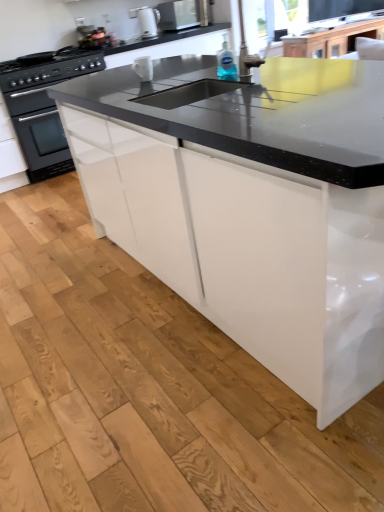
Question: Is black matte oven at left oriented away from white glossy electric kettle at upper center, which is counted as the 2th appliance, starting from the right?

Choices:
 (A) yes
 (B) no

Answer: (B)

Question: Can you see black matte oven at left touching white glossy electric kettle at upper center, arranged as the 1th appliance when viewed from the left?

Choices:
 (A) yes
 (B) no

Answer: (B)

Question: Considering the relative sizes of black matte oven at left and white glossy electric kettle at upper center, which is counted as the 2th appliance, starting from the right, in the image provided, is black matte oven at left taller than white glossy electric kettle at upper center, which is counted as the 2th appliance, starting from the right,?

Choices:
 (A) yes
 (B) no

Answer: (A)

Question: From the image's perspective, is black matte oven at left under white glossy electric kettle at upper center, which appears as the 1th appliance when viewed from the top?

Choices:
 (A) no
 (B) yes

Answer: (B)

Question: Does black matte oven at left have a greater width compared to white glossy electric kettle at upper center, which is counted as the 2th appliance, starting from the right?

Choices:
 (A) no
 (B) yes

Answer: (B)

Question: From their relative heights in the image, would you say transparent plastic bottle at upper center is taller or shorter than black matte oven at left?

Choices:
 (A) short
 (B) tall

Answer: (A)

Question: From a real-world perspective, is transparent plastic bottle at upper center physically located above or below black matte oven at left?

Choices:
 (A) above
 (B) below

Answer: (A)

Question: Considering the relative positions of transparent plastic bottle at upper center and black matte oven at left in the image provided, is transparent plastic bottle at upper center to the left or to the right of black matte oven at left?

Choices:
 (A) right
 (B) left

Answer: (A)

Question: In terms of size, does transparent plastic bottle at upper center appear bigger or smaller than black matte oven at left?

Choices:
 (A) small
 (B) big

Answer: (A)

Question: From a real-world perspective, is white glossy mug at upper center, the second appliance when ordered from left to right, above or below black matte oven at left?

Choices:
 (A) above
 (B) below

Answer: (A)

Question: Does point (142, 66) appear closer or farther from the camera than point (66, 59)?

Choices:
 (A) farther
 (B) closer

Answer: (B)

Question: In terms of width, does white glossy mug at upper center, the second appliance when ordered from left to right, look wider or thinner when compared to black matte oven at left?

Choices:
 (A) thin
 (B) wide

Answer: (A)

Question: From the image's perspective, relative to black matte oven at left, is white glossy mug at upper center, the 2th appliance when ordered from back to front, above or below?

Choices:
 (A) below
 (B) above

Answer: (A)

Question: From the image's perspective, is white glossy electric kettle at upper center, marked as the 2th appliance in a bottom-to-top arrangement, above or below white glossy mug at upper center, the first appliance when ordered from bottom to top?

Choices:
 (A) below
 (B) above

Answer: (B)

Question: From a real-world perspective, relative to white glossy mug at upper center, positioned as the 2th appliance in top-to-bottom order, is white glossy electric kettle at upper center, which appears as the 1th appliance when viewed from the top, vertically above or below?

Choices:
 (A) above
 (B) below

Answer: (A)